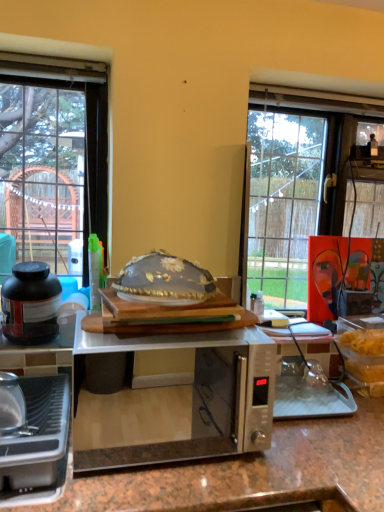
Question: From their relative heights in the image, would you say matte black jar at left, the 1th kitchen appliance from the back, is taller or shorter than satin silver microwave at center?

Choices:
 (A) tall
 (B) short

Answer: (B)

Question: Is matte black jar at left, the 1th kitchen appliance from the back, situated inside satin silver microwave at center or outside?

Choices:
 (A) inside
 (B) outside

Answer: (B)

Question: Which object is the closest to the satin silver microwave at center?

Choices:
 (A) translucent glass bowl at center
 (B) matte black jar at left, the 2th kitchen appliance positioned from the bottom
 (C) metallic silver toaster at lower left, the first kitchen appliance when ordered from front to back

Answer: (B)

Question: Considering the real-world distances, which object is closest to the matte black jar at left, placed as the 1th kitchen appliance when sorted from top to bottom?

Choices:
 (A) metallic silver toaster at lower left, acting as the 2th kitchen appliance starting from the top
 (B) translucent glass bowl at center
 (C) satin silver microwave at center

Answer: (A)